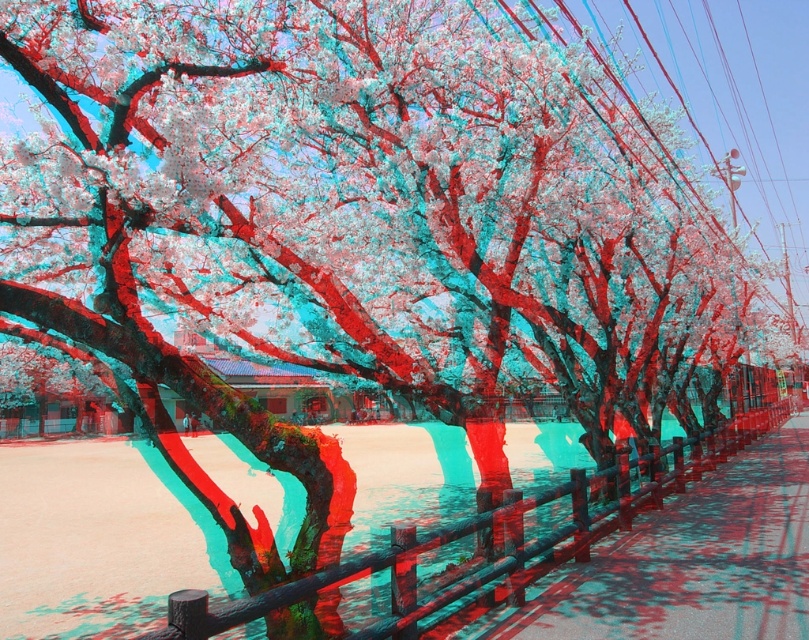
You are walking along the pathway and want to know the position of the smooth concrete pavement at center relative to the wooden fence at center. Which object is on the right side?

The smooth concrete pavement at center is positioned on the right side of wooden fence at center.

Looking at this image, you are standing on the pathway and want to place a large decorative stone that is 2 meters wide. Given the sizes of the smooth concrete pavement at center and the wooden fence at center, which object can accommodate the stone without overlapping?

The wooden fence at center is larger in size than the smooth concrete pavement at center. Therefore, the stone can be placed on the wooden fence at center since it has enough space to accommodate the 2 meters width without overlapping.